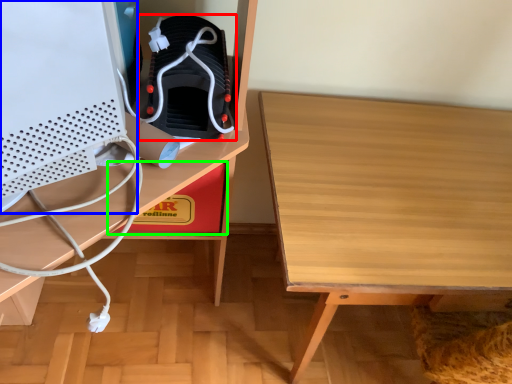
Question: Estimate the real-world distances between objects in this image. Which object is closer to footwear (highlighted by a red box), desktop computer (highlighted by a blue box) or cardboard box (highlighted by a green box)?

Choices:
 (A) desktop computer
 (B) cardboard box

Answer: (A)